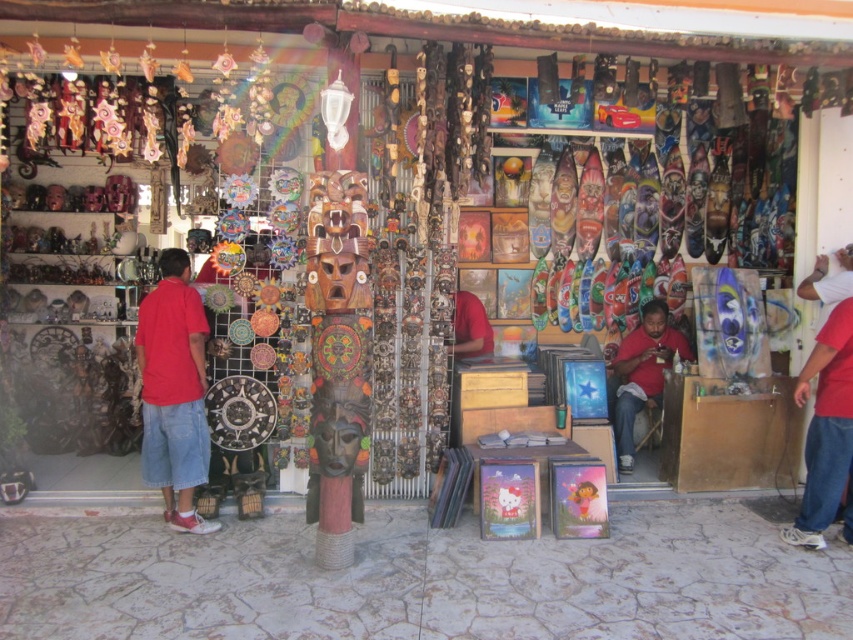
Question: Which point is closer to the camera?

Choices:
 (A) red cotton shirt at left
 (B) matte red shirt at center

Answer: (A)

Question: Does red cotton shirt at left have a lesser width compared to matte red shirt at center?

Choices:
 (A) yes
 (B) no

Answer: (A)

Question: Is red cotton shirt at left below matte red shirt at center?

Choices:
 (A) no
 (B) yes

Answer: (A)

Question: Can you confirm if red cotton shirt at left is positioned below matte red shirt at center?

Choices:
 (A) no
 (B) yes

Answer: (A)

Question: Which point is farther to the camera?

Choices:
 (A) red cotton shirt at left
 (B) matte red shirt at center

Answer: (B)